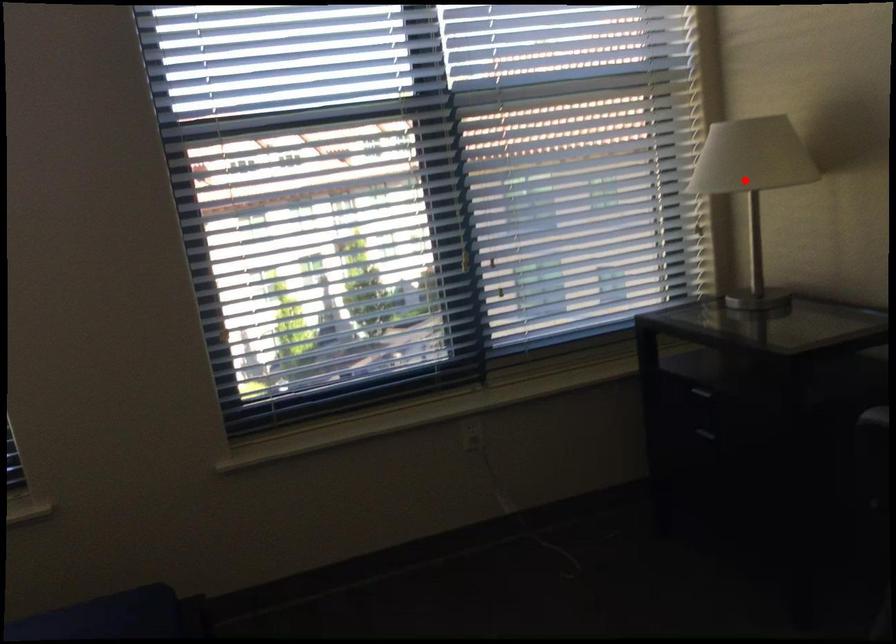
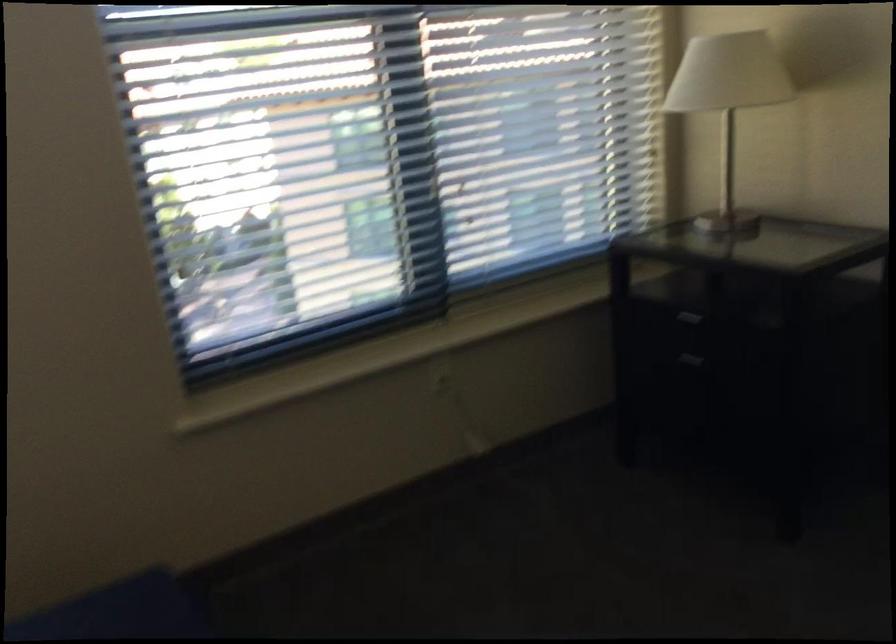
Find the pixel in the second image that matches the highlighted location in the first image.

(728, 102)